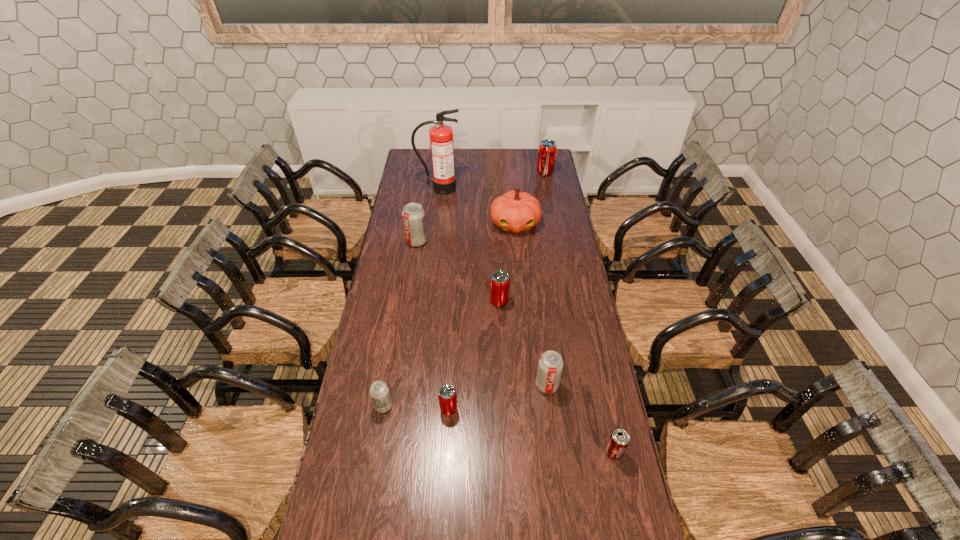
Where is `object identified as the sixth closest to the eighth nearest object`? Image resolution: width=960 pixels, height=540 pixels. object identified as the sixth closest to the eighth nearest object is located at coordinates (379, 391).

Select which soda can appears as the closest to the second smallest gray soda can. Please provide its 2D coordinates. Your answer should be formatted as a tuple, i.e. [(x, y)], where the tuple contains the x and y coordinates of a point satisfying the conditions above.

[(447, 395)]

The image size is (960, 540). What are the coordinates of `soda can that is the second closest one to the pink pumpkin` in the screenshot? It's located at click(x=547, y=149).

At what (x,y) coordinates should I click in order to perform the action: click on red soda can that can be found as the closest to the nearest red soda can. Please return your answer as a coordinate pair (x, y). Looking at the image, I should click on (499, 282).

The image size is (960, 540). I want to click on red soda can that is the second closest one to the leftmost red soda can, so click(x=547, y=149).

The width and height of the screenshot is (960, 540). Find the location of `gray soda can that is the second closest one to the pumpkin`. gray soda can that is the second closest one to the pumpkin is located at coordinates (550, 365).

Identify the location of the closest gray soda can to the farthest soda can. (413, 215).

Identify the location of vacant space that satisfies the following two spatial constraints: 1. on the front side of the fourth farthest soda can; 2. on the left side of the biggest gray soda can. The width and height of the screenshot is (960, 540). (395, 384).

In order to click on vacant region that satisfies the following two spatial constraints: 1. on the back side of the rightmost gray soda can; 2. on the right side of the smallest gray soda can in this screenshot , I will do `click(387, 384)`.